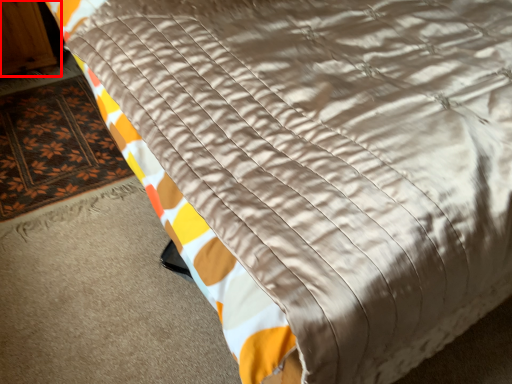
Question: From the image's perspective, what is the correct spatial positioning of armoire (annotated by the red box) in reference to mat?

Choices:
 (A) above
 (B) below

Answer: (A)